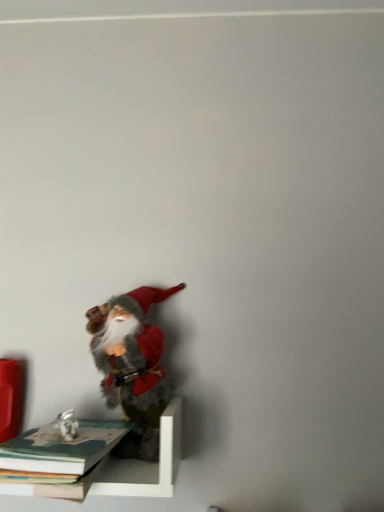
Locate an element on the screen. empty space that is ontop of hardcover book at lower left, which appears as the second book when ordered from the bottom (from a real-world perspective) is located at coordinates (45, 446).